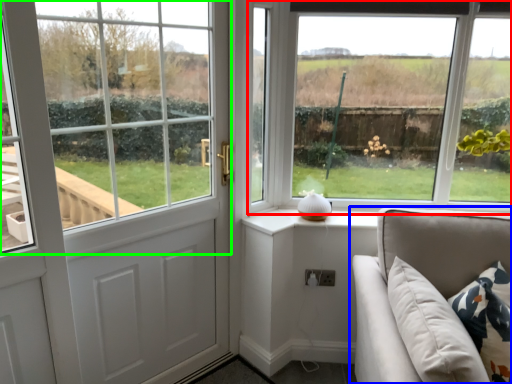
Question: Which object is positioned closest to window (highlighted by a red box)? Select from studio couch (highlighted by a blue box) and window (highlighted by a green box).

Choices:
 (A) studio couch
 (B) window

Answer: (B)